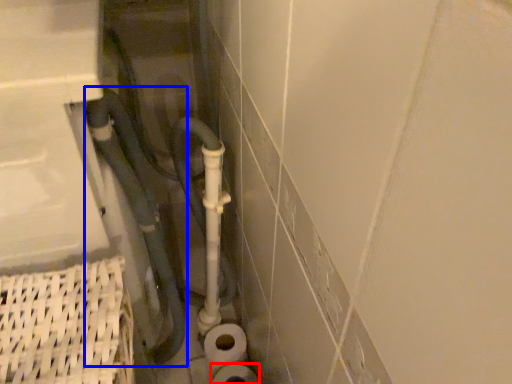
Question: Which point is further to the camera, toilet paper (highlighted by a red box) or water pipe (highlighted by a blue box)?

Choices:
 (A) toilet paper
 (B) water pipe

Answer: (A)